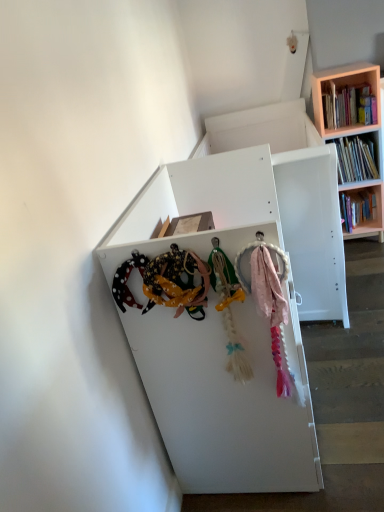
Image resolution: width=384 pixels, height=512 pixels. Describe the element at coordinates (347, 100) in the screenshot. I see `wooden bookshelf at upper right` at that location.

This screenshot has width=384, height=512. What do you see at coordinates (348, 105) in the screenshot?
I see `wooden bookshelf at upper right` at bounding box center [348, 105].

Where is `white matte shelf at center`? white matte shelf at center is located at coordinates (226, 400).

What's the angular difference between white matte shelf at center and wooden bookshelf at upper right's facing directions?

91 degrees separate the facing orientations of white matte shelf at center and wooden bookshelf at upper right.

Does white matte shelf at center have a smaller size compared to wooden bookshelf at upper right?

Incorrect, white matte shelf at center is not smaller in size than wooden bookshelf at upper right.

From the image's perspective, does white matte shelf at center appear higher than wooden bookshelf at upper right?

No, from the image's perspective, white matte shelf at center is not above wooden bookshelf at upper right.

Considering the sizes of objects white matte shelf at center and wooden bookshelf at upper right in the image provided, who is thinner, white matte shelf at center or wooden bookshelf at upper right?

Thinner between the two is wooden bookshelf at upper right.

From the picture: From the image's perspective, does wooden bookshelf at upper right appear lower than white matte shelf at center?

No.

Considering the points (333, 109) and (103, 252), which point is in front, point (333, 109) or point (103, 252)?

Point (103, 252)

Is wooden bookshelf at upper right further to the viewer compared to white matte shelf at center?

Yes, wooden bookshelf at upper right is behind white matte shelf at center.

Is wooden bookshelf at upper right wider than white matte shelf at center?

No, wooden bookshelf at upper right is not wider than white matte shelf at center.

Who is more distant, wooden bookshelf at upper right or white matte shelf at center?

wooden bookshelf at upper right is further from the camera.

Is wooden bookshelf at upper right not close to white matte shelf at center?

wooden bookshelf at upper right is far away from white matte shelf at center.

From a real-world perspective, who is located higher, wooden bookshelf at upper right or white matte shelf at center?

In real-world perspective, wooden bookshelf at upper right is above.

How far apart are wooden bookshelf at upper right and wooden bookshelf at upper right?

wooden bookshelf at upper right and wooden bookshelf at upper right are 4.61 inches apart from each other.

Is wooden bookshelf at upper right in front of or behind wooden bookshelf at upper right in the image?

In the image, wooden bookshelf at upper right appears behind wooden bookshelf at upper right.

Which of these two, wooden bookshelf at upper right or wooden bookshelf at upper right, is bigger?

Bigger between the two is wooden bookshelf at upper right.

From a real-world perspective, is wooden bookshelf at upper right positioned above or below wooden bookshelf at upper right?

Clearly, from a real-world perspective, wooden bookshelf at upper right is above wooden bookshelf at upper right.

From the image's perspective, relative to wooden bookshelf at upper right, is white matte shelf at center above or below?

From the image's perspective, white matte shelf at center appears below wooden bookshelf at upper right.

Is point (249, 307) more distant than point (342, 120)?

No, it is in front of (342, 120).

Considering the relative sizes of white matte shelf at center and wooden bookshelf at upper right in the image provided, is white matte shelf at center smaller than wooden bookshelf at upper right?

No.

Does wooden bookshelf at upper right lie behind wooden bookshelf at upper right?

No, wooden bookshelf at upper right is in front of wooden bookshelf at upper right.

From a real-world perspective, is wooden bookshelf at upper right above or below wooden bookshelf at upper right?

Clearly, from a real-world perspective, wooden bookshelf at upper right is below wooden bookshelf at upper right.

Find the location of a particular element. bookcase lying above the white matte shelf at center (from the image's perspective) is located at coordinates (347, 100).

Identify the location of shelf on the left side of wooden bookshelf at upper right. This screenshot has height=512, width=384. (226, 400).

Estimate the real-world distances between objects in this image. Which object is closer to wooden bookshelf at upper right, white matte shelf at center or wooden bookshelf at upper right?

wooden bookshelf at upper right.

Considering their positions, is wooden bookshelf at upper right positioned closer to wooden bookshelf at upper right than white matte shelf at center?

Based on the image, wooden bookshelf at upper right appears to be nearer to wooden bookshelf at upper right.

When comparing their distances from wooden bookshelf at upper right, does wooden bookshelf at upper right or white matte shelf at center seem closer?

wooden bookshelf at upper right lies closer to wooden bookshelf at upper right than the other object.

Which object lies further to the anchor point white matte shelf at center, wooden bookshelf at upper right or wooden bookshelf at upper right?

Based on the image, wooden bookshelf at upper right appears to be further to white matte shelf at center.

Based on their spatial positions, is wooden bookshelf at upper right or wooden bookshelf at upper right closer to white matte shelf at center?

wooden bookshelf at upper right is positioned closer to the anchor white matte shelf at center.

From the image, which object appears to be farther from wooden bookshelf at upper right, white matte shelf at center or wooden bookshelf at upper right?

white matte shelf at center is further to wooden bookshelf at upper right.

Find the location of a particular element. Image resolution: width=384 pixels, height=512 pixels. bookcase between white matte shelf at center and wooden bookshelf at upper right from front to back is located at coordinates (347, 100).